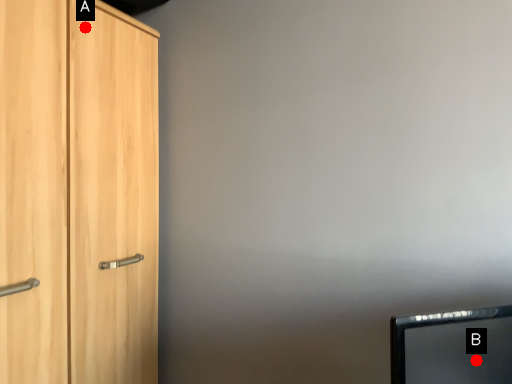
Question: Two points are circled on the image, labeled by A and B beside each circle. Which point is further to the camera?

Choices:
 (A) A is further
 (B) B is further

Answer: (A)